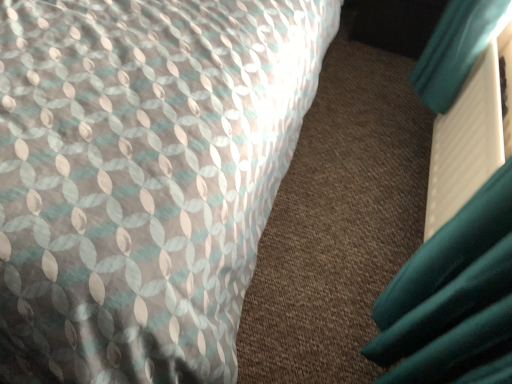
Question: From a real-world perspective, relative to teal matte book at right, is textured fabric bed at upper left vertically above or below?

Choices:
 (A) below
 (B) above

Answer: (B)

Question: Is textured fabric bed at upper left inside the boundaries of teal matte book at right, or outside?

Choices:
 (A) outside
 (B) inside

Answer: (A)

Question: From the image's perspective, is textured fabric bed at upper left located above or below teal matte book at right?

Choices:
 (A) above
 (B) below

Answer: (A)

Question: Looking at their shapes, would you say teal matte book at right is wider or thinner than textured fabric bed at upper left?

Choices:
 (A) wide
 (B) thin

Answer: (B)

Question: From a real-world perspective, relative to textured fabric bed at upper left, is teal matte book at right vertically above or below?

Choices:
 (A) above
 (B) below

Answer: (B)

Question: From their relative heights in the image, would you say teal matte book at right is taller or shorter than textured fabric bed at upper left?

Choices:
 (A) tall
 (B) short

Answer: (B)

Question: Is teal matte book at right to the left or to the right of textured fabric bed at upper left in the image?

Choices:
 (A) left
 (B) right

Answer: (B)